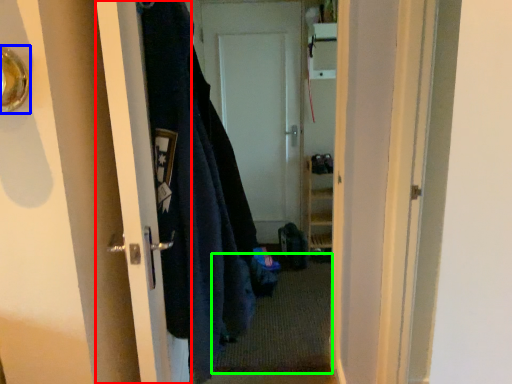
Question: Which is nearer to the door (highlighted by a red box)? door handle (highlighted by a blue box) or doormat (highlighted by a green box).

Choices:
 (A) door handle
 (B) doormat

Answer: (A)